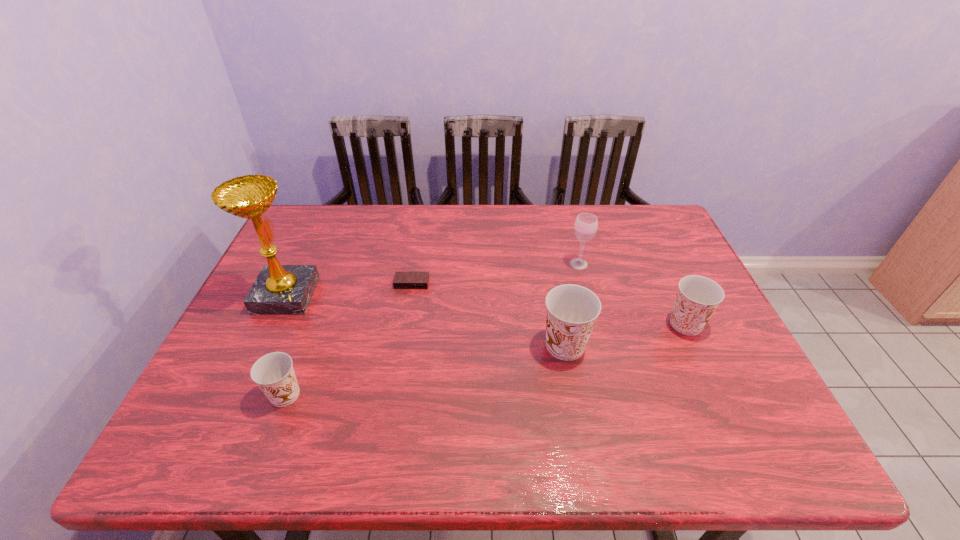
To achieve even spacing by inserting another Dixie_cup among them, please point to a vacant spot for this new Dixie_cup. Please provide its 2D coordinates. Your answer should be formatted as a tuple, i.e. [(x, y)], where the tuple contains the x and y coordinates of a point satisfying the conditions above.

[(432, 369)]